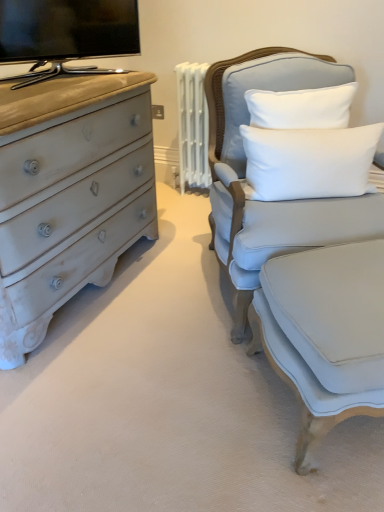
Question: Is point (253, 280) closer or farther from the camera than point (119, 38)?

Choices:
 (A) closer
 (B) farther

Answer: (A)

Question: Visually, is light gray fabric chair at right positioned to the left or to the right of flat-screen tv at upper left?

Choices:
 (A) left
 (B) right

Answer: (B)

Question: Which is farther from the flat-screen tv at upper left?

Choices:
 (A) light blue fabric swivel chair at right
 (B) light gray fabric chair at right
 (C) white soft cushion at upper right

Answer: (A)

Question: Considering the real-world distances, which object is farthest from the light blue fabric swivel chair at right?

Choices:
 (A) white soft cushion at upper right
 (B) light gray fabric chair at right
 (C) flat-screen tv at upper left

Answer: (C)